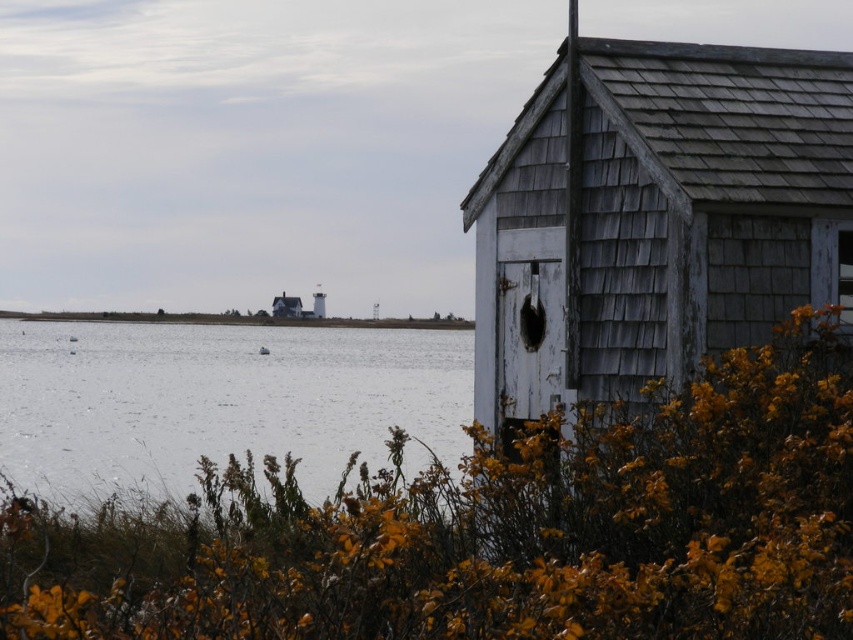
Is point (705, 54) farther from viewer compared to point (131, 412)?

No, (705, 54) is in front of (131, 412).

From the picture: Does weathered wood hut at right have a greater height compared to white water at center?

Yes.

Who is more distant from viewer, (607, 77) or (291, 332)?

The point (291, 332) is behind.

Locate an element on the screen. The height and width of the screenshot is (640, 853). weathered wood hut at right is located at coordinates [x=654, y=216].